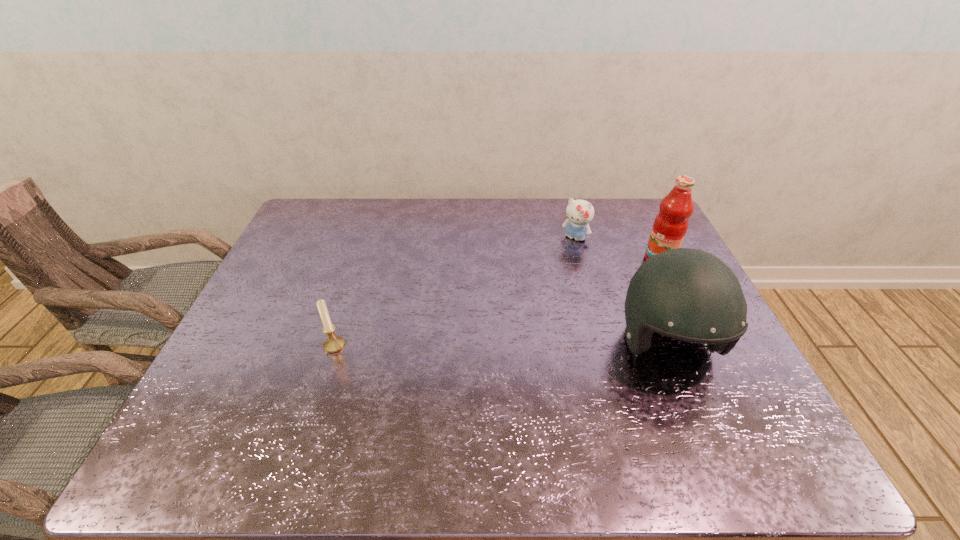
Select which object appears as the second closest to the leftmost object. Please provide its 2D coordinates. Your answer should be formatted as a tuple, i.e. [(x, y)], where the tuple contains the x and y coordinates of a point satisfying the conditions above.

[(579, 213)]

Where is `blank area in the image that satisfies the following two spatial constraints: 1. on the back side of the farthest object; 2. on the right side of the leftmost object`? blank area in the image that satisfies the following two spatial constraints: 1. on the back side of the farthest object; 2. on the right side of the leftmost object is located at coordinates (369, 238).

Locate an element on the screen. free space that satisfies the following two spatial constraints: 1. on the front side of the fruit juice; 2. on the right side of the kitten is located at coordinates (580, 260).